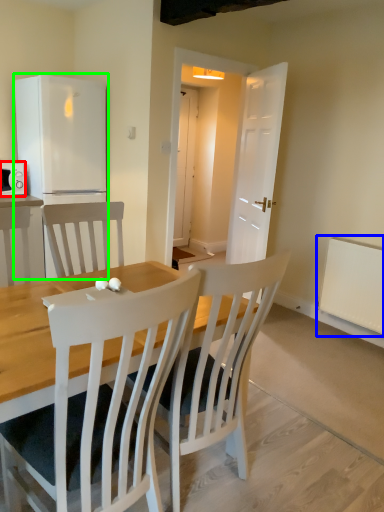
Question: Considering the real-world distances, which object is closest to microwave oven (highlighted by a red box)? radiator (highlighted by a blue box) or refrigerator (highlighted by a green box).

Choices:
 (A) radiator
 (B) refrigerator

Answer: (B)